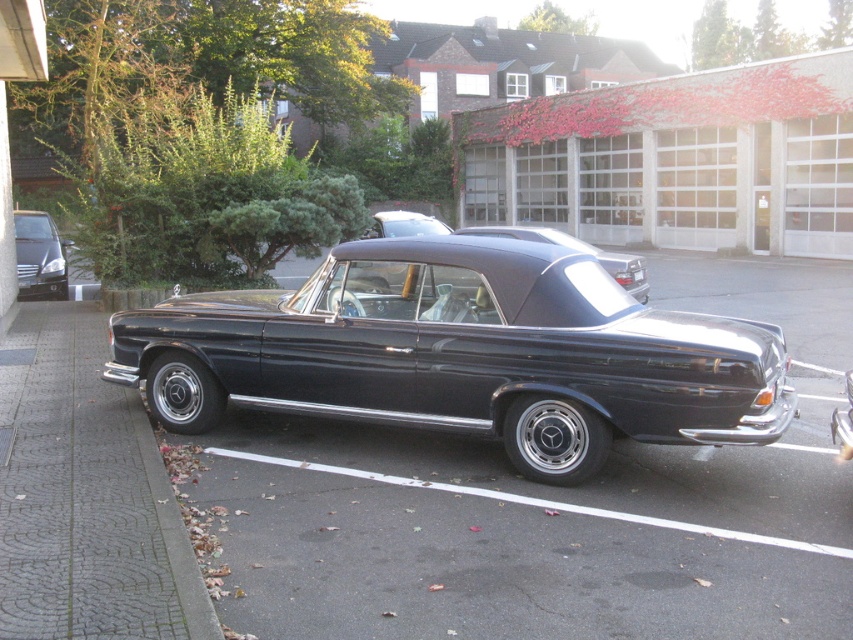
Question: From the image, what is the correct spatial relationship of matte black car at left in relation to glossy black convertible at center?

Choices:
 (A) above
 (B) below

Answer: (B)

Question: Can you confirm if shiny black convertible at center is positioned to the right of matte black car at left?

Choices:
 (A) no
 (B) yes

Answer: (B)

Question: Which object is closer to the camera taking this photo?

Choices:
 (A) shiny black convertible at center
 (B) matte black car at left
 (C) glossy black convertible at center

Answer: (A)

Question: Does shiny black convertible at center have a greater width compared to matte black car at left?

Choices:
 (A) no
 (B) yes

Answer: (B)

Question: Which object appears farthest from the camera in this image?

Choices:
 (A) shiny black convertible at center
 (B) glossy black convertible at center

Answer: (B)

Question: Which object is positioned farthest from the glossy black convertible at center?

Choices:
 (A) shiny black convertible at center
 (B) matte black car at left

Answer: (B)